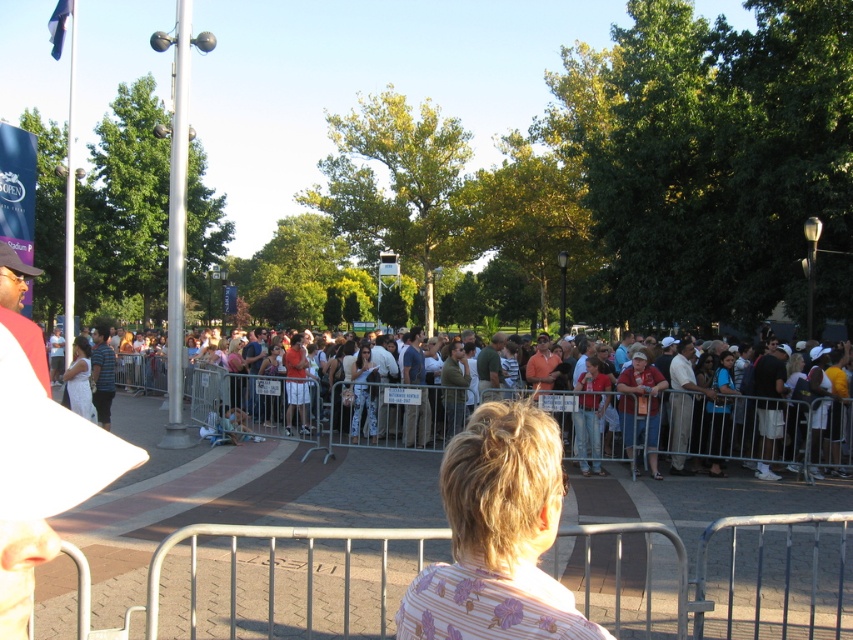
Question: Which of the following is the closest to the observer?

Choices:
 (A) denim pants at center
 (B) multicolored casual attire at center
 (C) blonde hair at center
 (D) white cotton dress at center

Answer: (C)

Question: Estimate the real-world distances between objects in this image. Which object is farther from the white cotton dress at center?

Choices:
 (A) blonde hair at center
 (B) denim pants at center
 (C) silver metallic barricade at center
 (D) multicolored casual attire at center

Answer: (A)

Question: Which point is farther from the camera taking this photo?

Choices:
 (A) (647, 564)
 (B) (756, 433)
 (C) (77, 371)

Answer: (C)

Question: Can you confirm if blonde hair at center is positioned above white cotton dress at center?

Choices:
 (A) yes
 (B) no

Answer: (A)

Question: Does multicolored casual attire at center appear on the right side of silver metallic barricade at center?

Choices:
 (A) yes
 (B) no

Answer: (B)

Question: In this image, where is multicolored casual attire at center located relative to white cotton dress at center?

Choices:
 (A) right
 (B) left

Answer: (A)